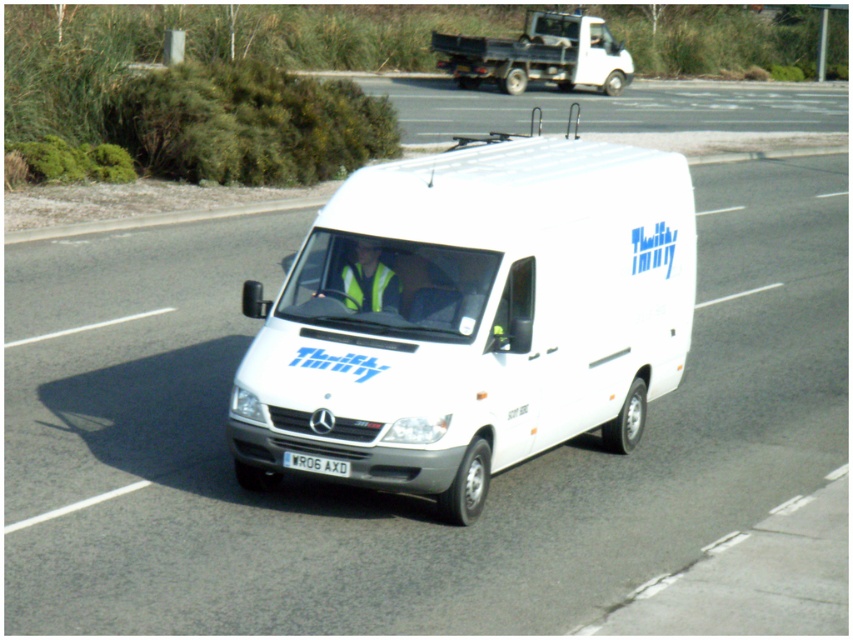
Who is lower down, white matte van at center or white plastic license plate at center?

Positioned lower is white plastic license plate at center.

Between point (285, 339) and point (322, 472), which one is positioned behind?

The point (285, 339) is more distant.

Locate an element on the screen. The image size is (853, 640). white matte van at center is located at coordinates 471,316.

Which is in front, point (608, 52) or point (294, 456)?

Point (294, 456) is more forward.

Between point (585, 44) and point (311, 461), which one is positioned in front?

Point (311, 461) is in front.

This screenshot has width=853, height=640. In order to click on white matte truck at upper center in this screenshot , I will do `click(538, 54)`.

Can you confirm if white matte van at center is positioned to the left of white matte truck at upper center?

Yes, white matte van at center is to the left of white matte truck at upper center.

Is white matte van at center behind white matte truck at upper center?

No, it is not.

Is point (404, 248) behind point (526, 72)?

No, (404, 248) is closer to viewer.

I want to click on white matte van at center, so click(x=471, y=316).